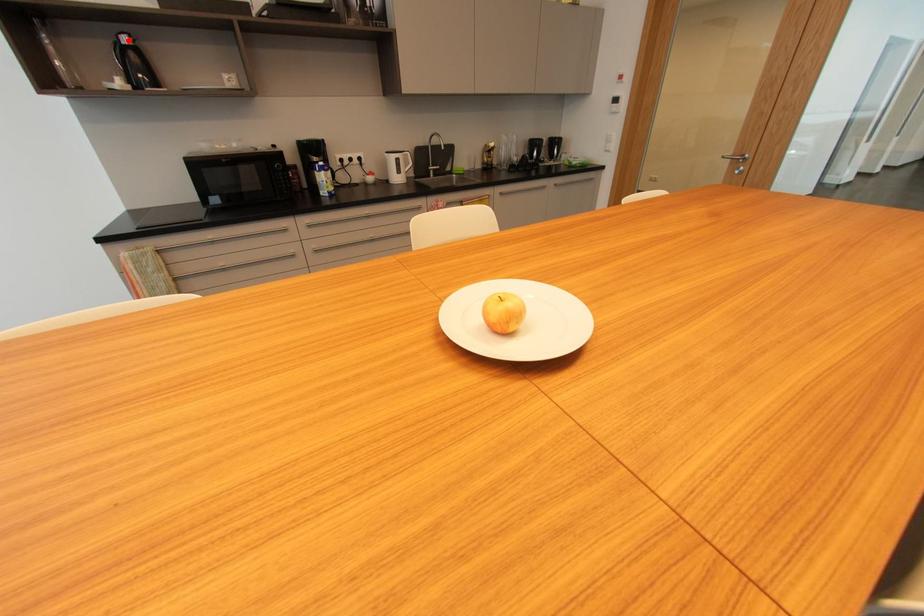
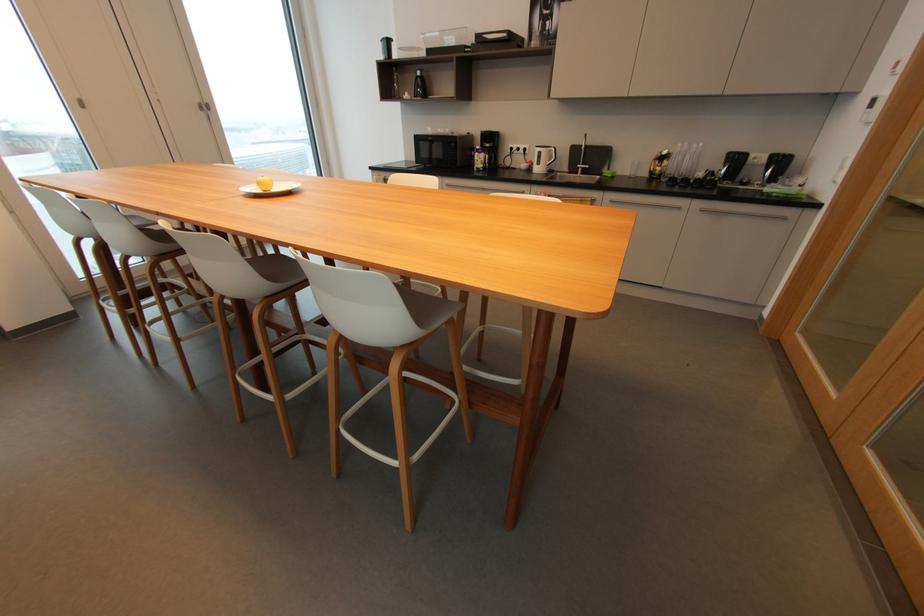
Question: I am providing you with two images of the same scene from different viewpoints. A red point is shown in image1. For the corresponding object point in image2, is it positioned nearer or farther from the camera?

Choices:
 (A) Nearer
 (B) Farther

Answer: (A)